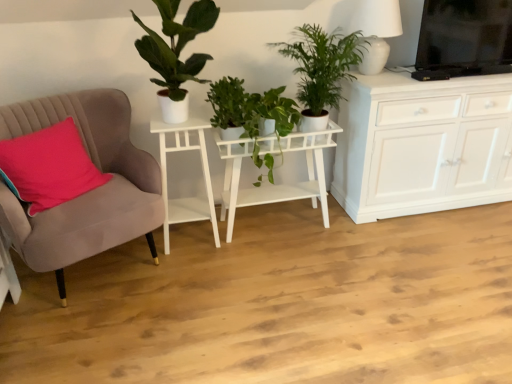
The image size is (512, 384). Find the location of `space that is in front of suede armchair at left`. space that is in front of suede armchair at left is located at coordinates (95, 341).